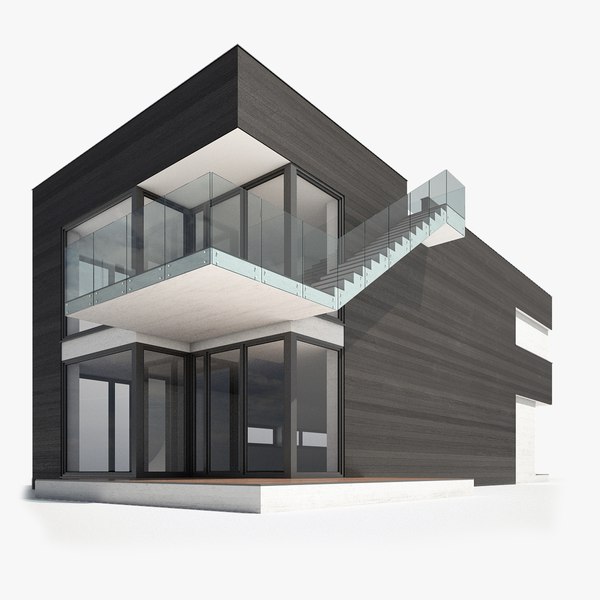
Identify the location of door. The width and height of the screenshot is (600, 600). (238, 427).